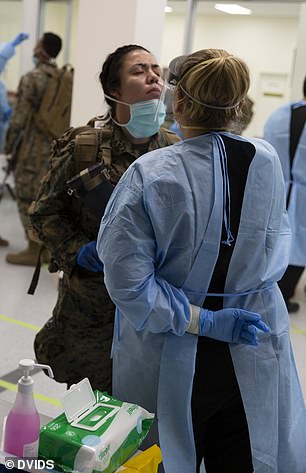
The height and width of the screenshot is (473, 306). I want to click on pillar, so click(x=99, y=44), click(x=29, y=13).